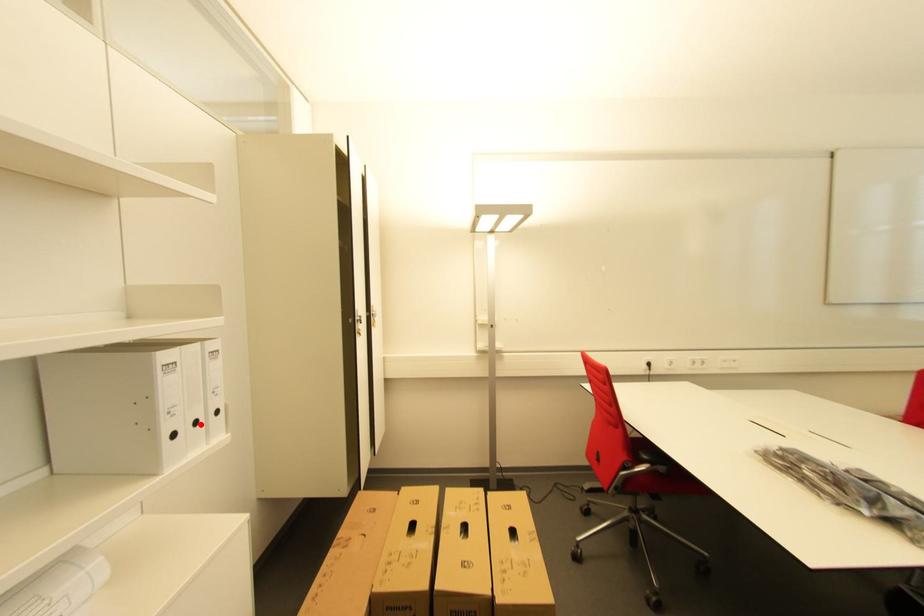
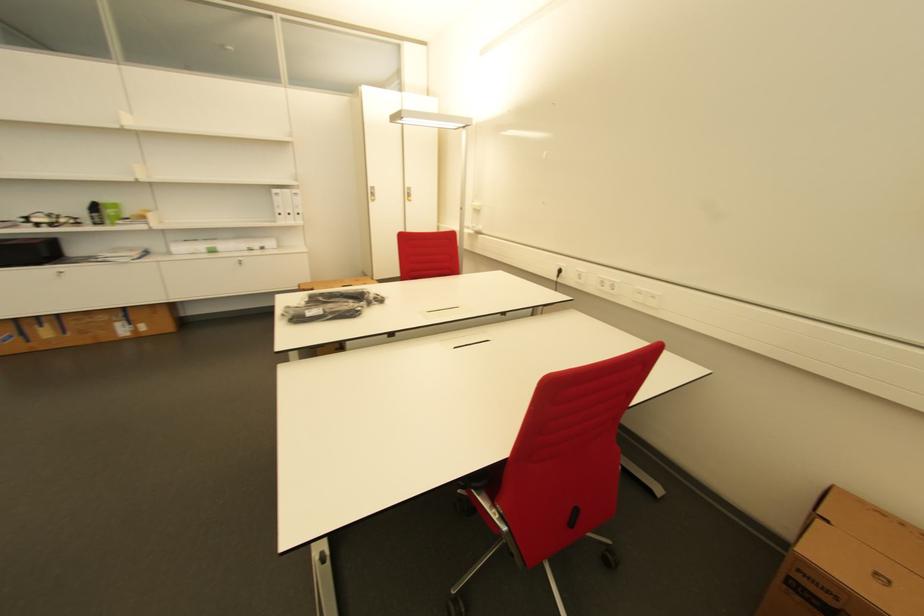
Locate, in the second image, the point that corresponds to the highlighted location in the first image.

(294, 216)